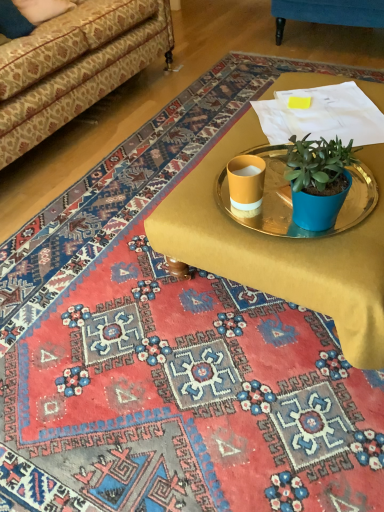
At what (x,y) coordinates should I click in order to perform the action: click on free space to the left of gold metallic tray at center. Please return your answer as a coordinate pair (x, y). The height and width of the screenshot is (512, 384). Looking at the image, I should click on (93, 267).